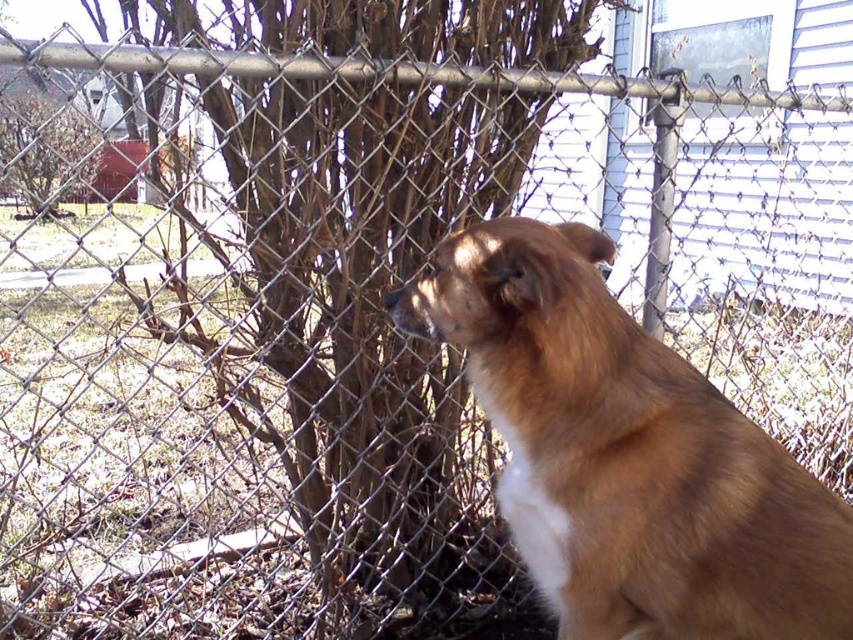
You are standing in front of the chain link fence and see the brown fluffy dog at center and the bare branches at upper left. Which object is closer to your left side?

The bare branches at upper left are closer to your left side because the brown fluffy dog at center is to the right of them.

You are standing in front of the chain link fence in the image. There are two points marked on the fence. One is at coordinate point (674,536) and the other is at point (80,173). Which point is closer to you?

Point (674,536) is closer to the viewer than point (80,173).